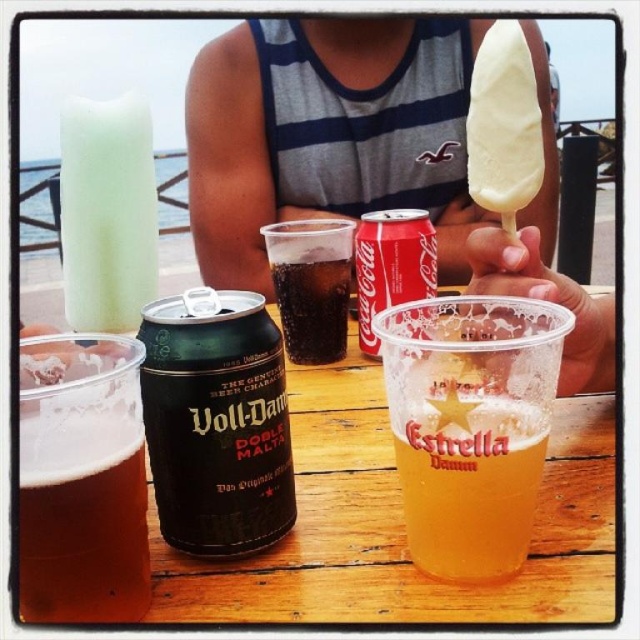
You are holding a camera and want to take a photo of the white creamy ice cream at upper center. The camera requires a minimum distance of 30 inches to focus properly. Can you take a clear photo from your current position?

The white creamy ice cream at upper center and camera are 28.50 inches apart, which is less than the required 30 inches. Therefore, you cannot take a clear photo from your current position.

You are setting up a picnic table for guests. You have a brown matte can at lower left and a dark brown glass at center. According to the scene, where is the brown matte can in relation to the dark brown glass?

The brown matte can at lower left is located below the dark brown glass at center.

You are standing in front of the table and want to pick up both items located at point (189, 484) and point (296, 296). Which item should you reach for first to minimize the distance you have to move your hand?

You should reach for the item at point (189, 484) first because it is closer to you than the item at point (296, 296).